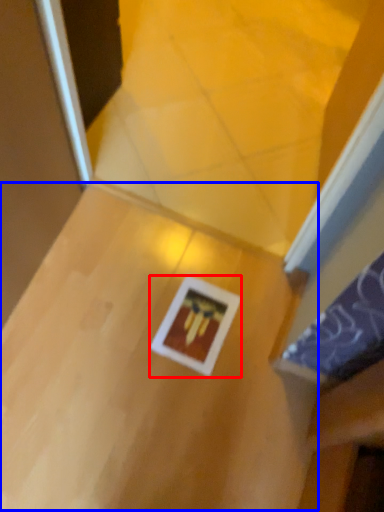
Question: Among these objects, which one is nearest to the camera, picture frame (highlighted by a red box) or table (highlighted by a blue box)?

Choices:
 (A) picture frame
 (B) table

Answer: (B)